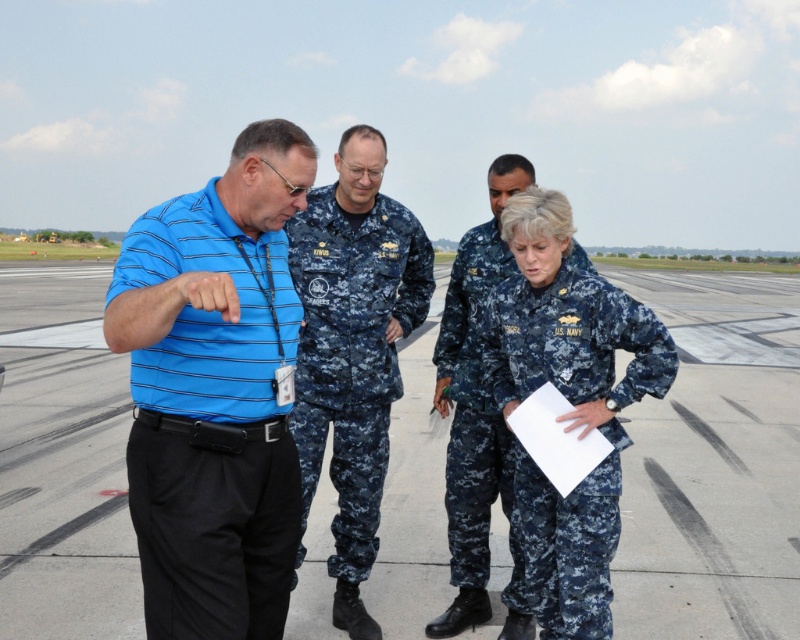
You are a photographer positioned at the edge of the runway. You need to take a photo that includes both the matte blue uniform at center and the digital camouflage uniform at center. Which uniform should you focus on first to ensure both are in the frame?

You should focus on the matte blue uniform at center first since it is closer to you than the digital camouflage uniform at center, ensuring both are in the frame.

You are standing on the airfield and see two points marked as point 1 at coordinates (544, 552) and point 2 at coordinates (440, 413). Which point is closer to you?

Point 1 at coordinates (544, 552) is closer to you than point 2 at coordinates (440, 413).

Consider the image. You are a security officer on the airfield and you need to identify which uniform is taller between the matte blue uniform at center and the navy blue uniform at center. Which one is taller?

The matte blue uniform at center is much taller than the navy blue uniform at center.